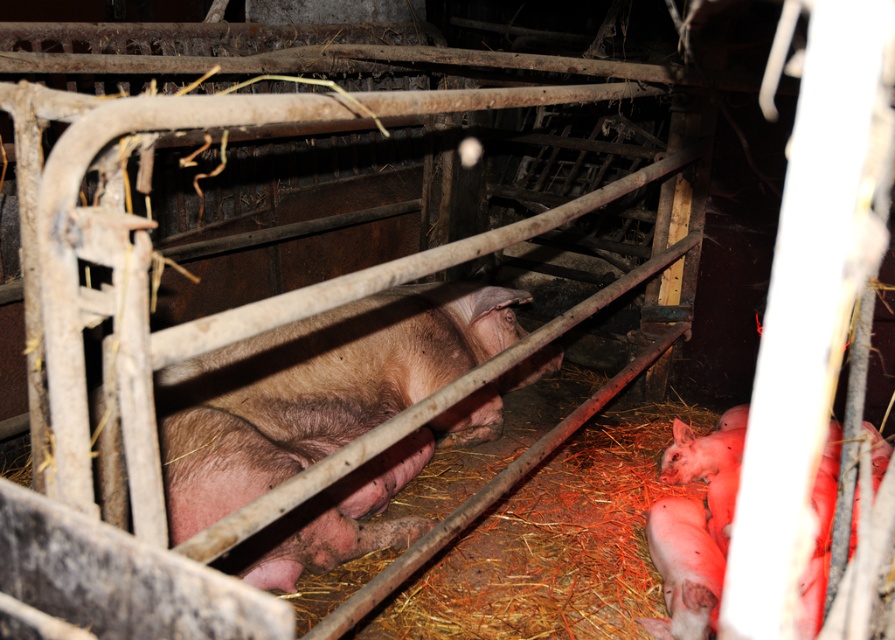
You are standing at the entrance of the pigsty and want to reach the point at the bottom right corner of the enclosure. You need to pass through two points marked as point [341,392] and point [654,625]. Which point should you go through first?

You should go through point [654,625] first because point [341,392] is behind it.